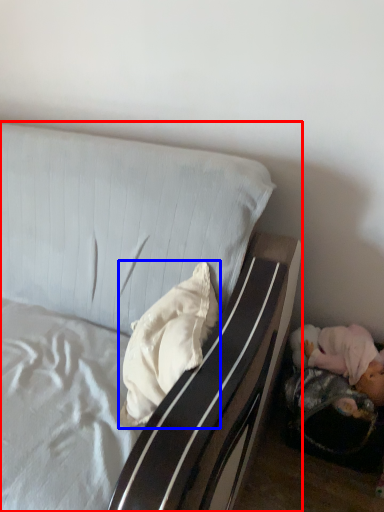
Question: Which of the following is the farthest to the observer, bed (highlighted by a red box) or pillow (highlighted by a blue box)?

Choices:
 (A) bed
 (B) pillow

Answer: (B)